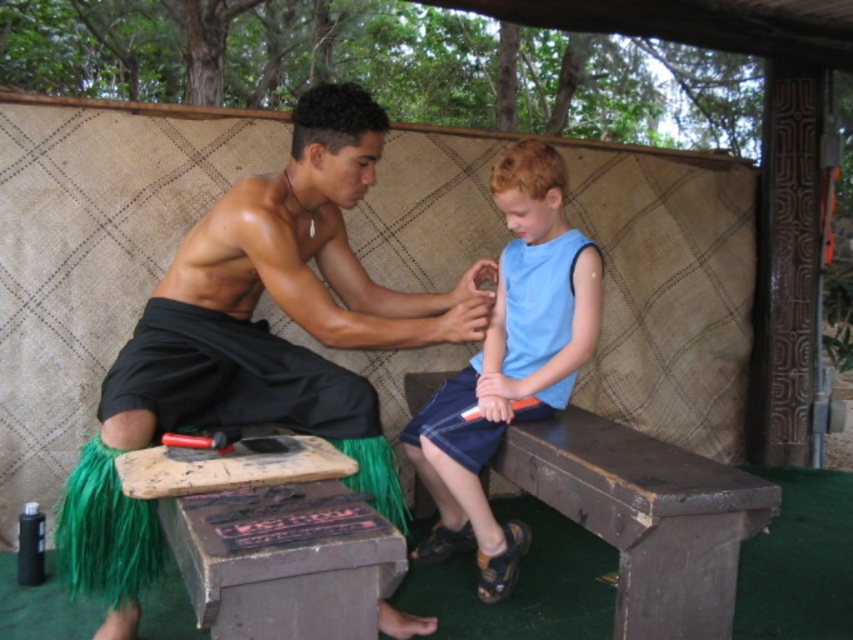
Question: Is blue cotton shirt at center positioned in front of brown wooden bench at lower center?

Choices:
 (A) no
 (B) yes

Answer: (A)

Question: Based on their relative distances, which object is farther from the black matte grass skirt at center?

Choices:
 (A) blue cotton shirt at center
 (B) brown wooden bench at lower center

Answer: (B)

Question: Can you confirm if black matte grass skirt at center is positioned to the right of blue cotton shirt at center?

Choices:
 (A) yes
 (B) no

Answer: (B)

Question: Does black matte grass skirt at center have a lesser width compared to brown wooden bench at lower center?

Choices:
 (A) yes
 (B) no

Answer: (B)

Question: Based on their relative distances, which object is nearer to the brown wooden bench at lower center?

Choices:
 (A) blue cotton shirt at center
 (B) black matte grass skirt at center

Answer: (A)

Question: Considering the real-world distances, which object is closest to the black matte grass skirt at center?

Choices:
 (A) blue cotton shirt at center
 (B) brown wooden bench at lower center

Answer: (A)